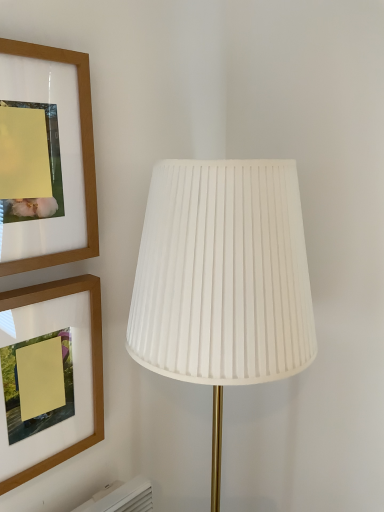
Question: Does white pleated fabric lamp at center appear on the left side of wooden picture frame at upper left, the first picture frame in the bottom-to-top sequence?

Choices:
 (A) yes
 (B) no

Answer: (B)

Question: Could you tell me if white pleated fabric lamp at center is turned towards wooden picture frame at upper left, the first picture frame in the bottom-to-top sequence?

Choices:
 (A) no
 (B) yes

Answer: (A)

Question: Is white pleated fabric lamp at center facing away from wooden picture frame at upper left, the first picture frame in the bottom-to-top sequence?

Choices:
 (A) no
 (B) yes

Answer: (A)

Question: From a real-world perspective, is white pleated fabric lamp at center beneath wooden picture frame at upper left, the first picture frame in the bottom-to-top sequence?

Choices:
 (A) no
 (B) yes

Answer: (B)

Question: From a real-world perspective, is white pleated fabric lamp at center over wooden picture frame at upper left, which is the second picture frame from top to bottom?

Choices:
 (A) no
 (B) yes

Answer: (A)

Question: In terms of height, does wooden picture frame at upper left, marked as the 1th picture frame in a top-to-bottom arrangement, look taller or shorter compared to wooden picture frame at upper left, which is the second picture frame from top to bottom?

Choices:
 (A) tall
 (B) short

Answer: (B)

Question: Choose the correct answer: Is wooden picture frame at upper left, which is the second picture frame from bottom to top, inside wooden picture frame at upper left, the first picture frame in the bottom-to-top sequence, or outside it?

Choices:
 (A) outside
 (B) inside

Answer: (A)

Question: Looking at the image, does wooden picture frame at upper left, marked as the 1th picture frame in a top-to-bottom arrangement, seem bigger or smaller compared to wooden picture frame at upper left, which is the second picture frame from top to bottom?

Choices:
 (A) small
 (B) big

Answer: (A)

Question: From a real-world perspective, is wooden picture frame at upper left, marked as the 1th picture frame in a top-to-bottom arrangement, above or below wooden picture frame at upper left, which is the second picture frame from top to bottom?

Choices:
 (A) above
 (B) below

Answer: (A)

Question: In terms of height, does wooden picture frame at upper left, the first picture frame in the bottom-to-top sequence, look taller or shorter compared to wooden picture frame at upper left, marked as the 1th picture frame in a top-to-bottom arrangement?

Choices:
 (A) short
 (B) tall

Answer: (B)

Question: From the image's perspective, is wooden picture frame at upper left, which is the second picture frame from top to bottom, located above or below wooden picture frame at upper left, marked as the 1th picture frame in a top-to-bottom arrangement?

Choices:
 (A) below
 (B) above

Answer: (A)

Question: Would you say wooden picture frame at upper left, the first picture frame in the bottom-to-top sequence, is inside or outside wooden picture frame at upper left, marked as the 1th picture frame in a top-to-bottom arrangement?

Choices:
 (A) outside
 (B) inside

Answer: (A)

Question: Considering the positions of point (44, 287) and point (87, 81), is point (44, 287) closer or farther from the camera than point (87, 81)?

Choices:
 (A) farther
 (B) closer

Answer: (A)

Question: Is wooden picture frame at upper left, which is the second picture frame from top to bottom, in front of or behind white pleated fabric lamp at center in the image?

Choices:
 (A) front
 (B) behind

Answer: (B)

Question: Choose the correct answer: Is wooden picture frame at upper left, the first picture frame in the bottom-to-top sequence, inside white pleated fabric lamp at center or outside it?

Choices:
 (A) inside
 (B) outside

Answer: (B)